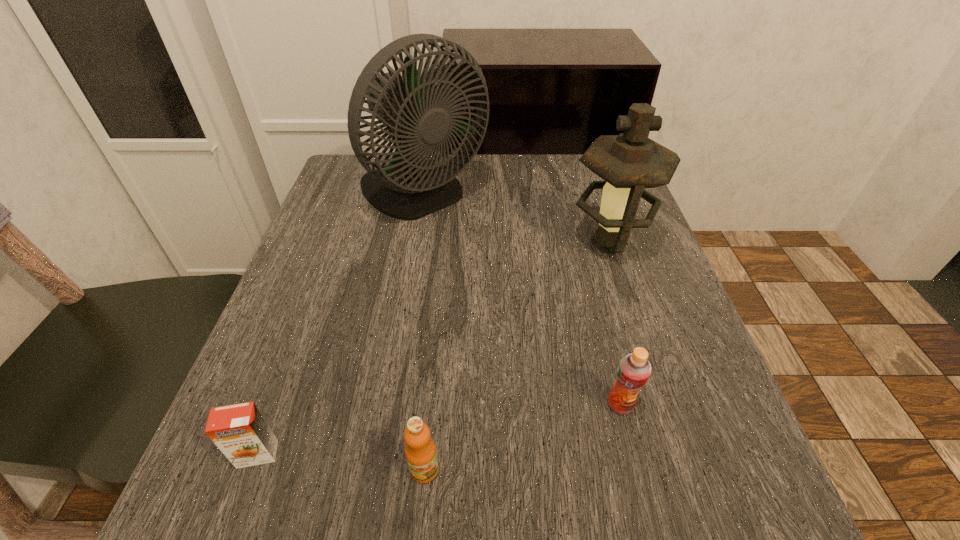
Locate an element on the screen. This screenshot has height=540, width=960. free area in between the oil lamp and the fan is located at coordinates (516, 219).

Identify the location of free point between the leftmost orange juice and the second orange juice from left to right. Image resolution: width=960 pixels, height=540 pixels. (341, 462).

Where is `empty space between the second tallest object and the shortest orange juice`? The image size is (960, 540). empty space between the second tallest object and the shortest orange juice is located at coordinates (433, 349).

At what (x,y) coordinates should I click in order to perform the action: click on blank region between the leftmost orange juice and the second tallest object. Please return your answer as a coordinate pair (x, y). The height and width of the screenshot is (540, 960). Looking at the image, I should click on (433, 349).

Point out which object is positioned as the third nearest to the third farthest object. Please provide its 2D coordinates. Your answer should be formatted as a tuple, i.e. [(x, y)], where the tuple contains the x and y coordinates of a point satisfying the conditions above.

[(419, 119)]

Locate which object ranks in proximity to the farthest orange juice. Please provide its 2D coordinates. Your answer should be formatted as a tuple, i.e. [(x, y)], where the tuple contains the x and y coordinates of a point satisfying the conditions above.

[(420, 451)]

In order to click on orange juice that is the second closest to the shortest object in this screenshot , I will do `click(633, 371)`.

Identify which orange juice is the second closest to the second orange juice from right to left. Please provide its 2D coordinates. Your answer should be formatted as a tuple, i.e. [(x, y)], where the tuple contains the x and y coordinates of a point satisfying the conditions above.

[(633, 371)]

The width and height of the screenshot is (960, 540). What are the coordinates of `free spot that satisfies the following two spatial constraints: 1. in front of the rightmost orange juice to direct airflow; 2. on the right side of the tallest object` in the screenshot? It's located at (388, 404).

Locate an element on the screen. The height and width of the screenshot is (540, 960). vacant space that satisfies the following two spatial constraints: 1. in front of the rightmost orange juice to direct airflow; 2. on the right side of the tallest object is located at coordinates (388, 404).